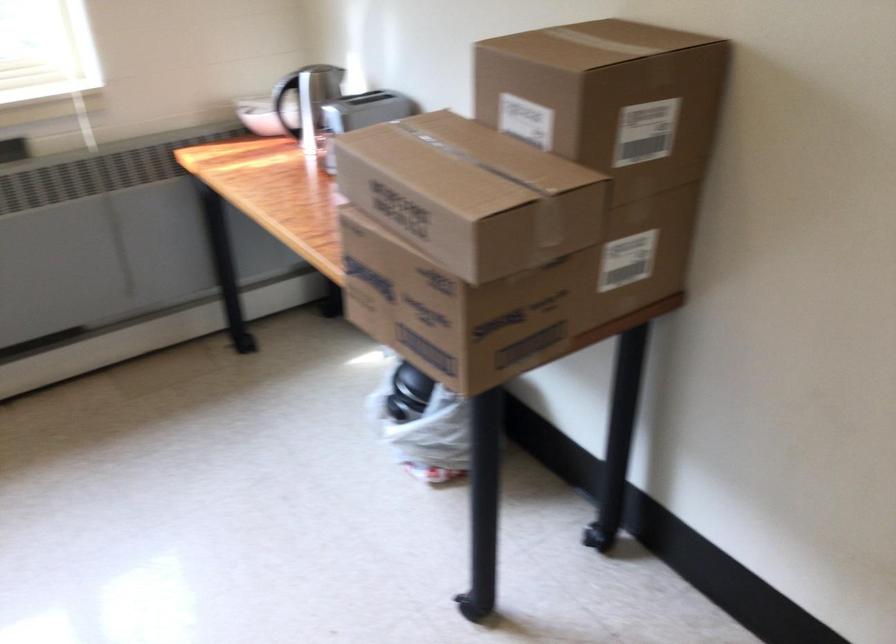
The image size is (896, 644). Identify the location of toaster lever. (323, 138).